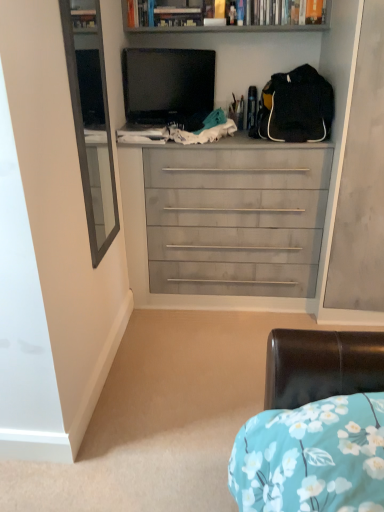
Question: Looking at their shapes, would you say matte gray chest of drawers at center is wider or thinner than matte black tv at upper center?

Choices:
 (A) thin
 (B) wide

Answer: (B)

Question: Looking at the image, does matte gray chest of drawers at center seem bigger or smaller compared to matte black tv at upper center?

Choices:
 (A) small
 (B) big

Answer: (B)

Question: Which object is positioned closest to the matte black tv at upper center?

Choices:
 (A) hardcover book at upper center
 (B) black matte backpack at upper right
 (C) wooden bookshelf at upper center
 (D) matte gray chest of drawers at center

Answer: (C)

Question: Which of these objects is positioned closest to the hardcover book at upper center?

Choices:
 (A) black matte backpack at upper right
 (B) matte gray chest of drawers at center
 (C) wooden bookshelf at upper center
 (D) matte black tv at upper center

Answer: (C)